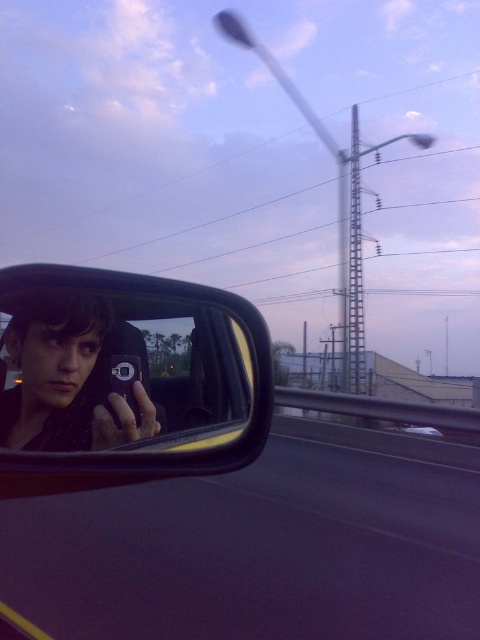
From the picture: Is shiny black phone at center to the right of metallic silver car at center from the viewer's perspective?

Incorrect, shiny black phone at center is not on the right side of metallic silver car at center.

Is point (255, 417) less distant than point (422, 429)?

That is True.

Identify the location of shiny black phone at center. The height and width of the screenshot is (640, 480). (134, 378).

You are a GUI agent. You are given a task and a screenshot of the screen. Output one action in this format:
    pyautogui.click(x=<x>, y=<y>)
    Task: Click on the shiny black phone at center
    The image size is (480, 640).
    Given the screenshot: What is the action you would take?
    pyautogui.click(x=134, y=378)